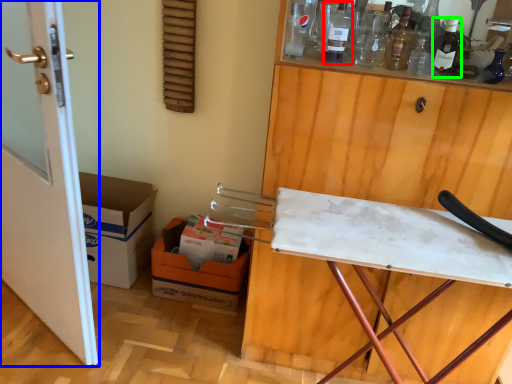
Question: Which is nearer to the bottle (highlighted by a red box)? door (highlighted by a blue box) or wine bottle (highlighted by a green box).

Choices:
 (A) door
 (B) wine bottle

Answer: (B)